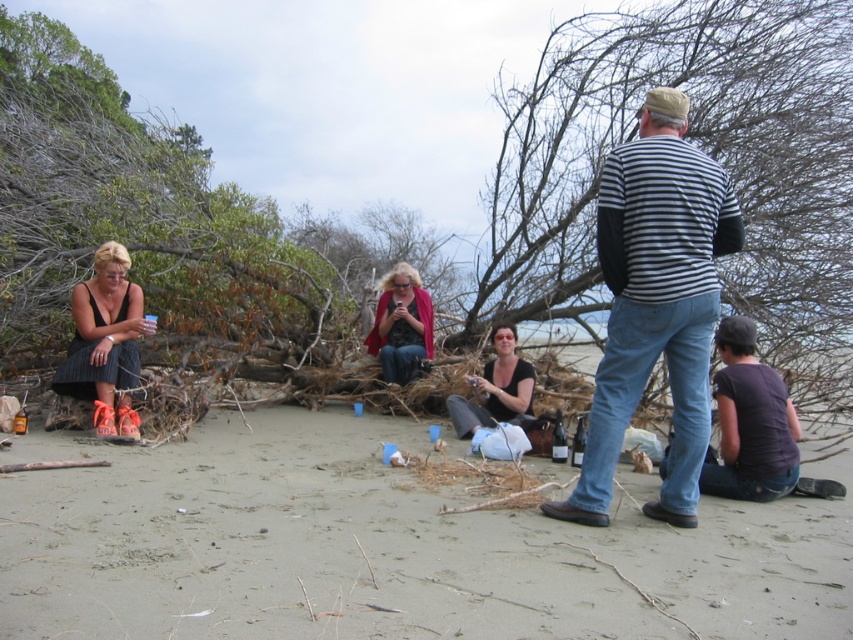
Which is behind, point (827, 600) or point (102, 310)?

Point (102, 310)

From the picture: Who is taller, smooth sand at center or matte black tank top at left?

matte black tank top at left is taller.

Locate an element on the screen. smooth sand at center is located at coordinates (386, 547).

Between matte black tank top at left and matte black shirt at center, which one appears on the right side from the viewer's perspective?

matte black shirt at center is more to the right.

Is matte black tank top at left thinner than matte black shirt at center?

No.

Locate an element on the screen. This screenshot has width=853, height=640. matte black tank top at left is located at coordinates (106, 342).

Find the location of `matte black tank top at left`. matte black tank top at left is located at coordinates (106, 342).

In the scene shown: How distant is smooth sand at center from matte pink coat at center?

smooth sand at center and matte pink coat at center are 4.63 meters apart.

Can you confirm if smooth sand at center is shorter than matte pink coat at center?

Indeed, smooth sand at center has a lesser height compared to matte pink coat at center.

I want to click on smooth sand at center, so click(x=386, y=547).